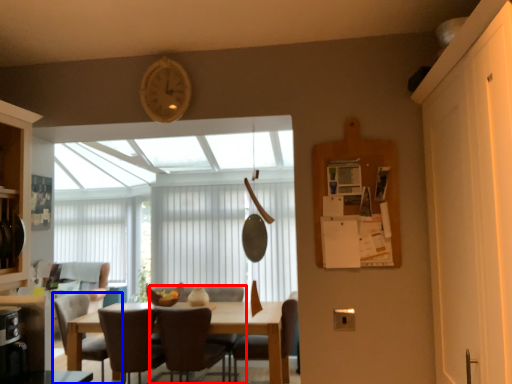
Question: Which object appears farthest to the camera in this image, chair (highlighted by a red box) or chair (highlighted by a blue box)?

Choices:
 (A) chair
 (B) chair

Answer: (B)